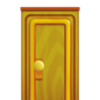
Identify the location of wooden door. The image size is (100, 100). (54, 39).